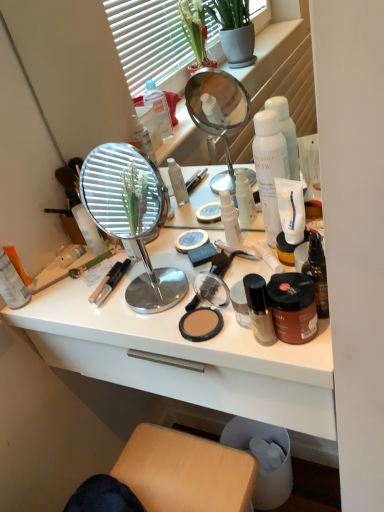
The width and height of the screenshot is (384, 512). What are the coordinates of `vacant area to the left of white matte tube at center-right, placed as the first product when sorted from bottom to top` in the screenshot? It's located at (190, 282).